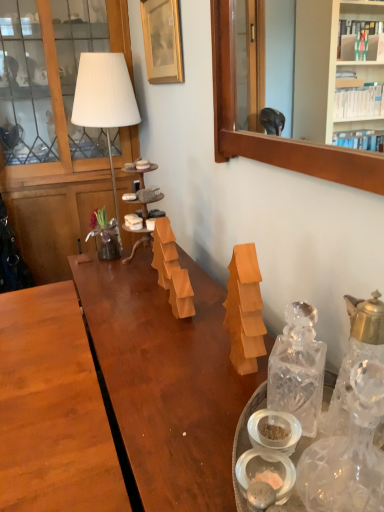
Find the location of a particular element. free spot behind white matte spice container at center is located at coordinates (248, 446).